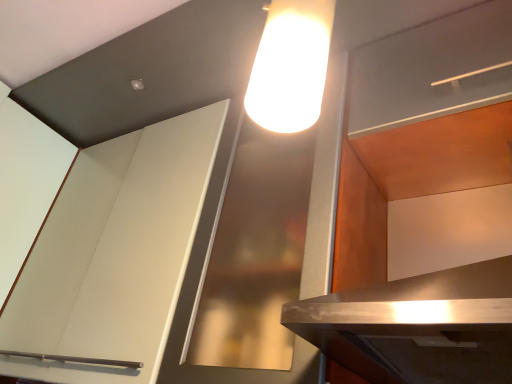
Identify the location of matte wood shelf at upper right. The image size is (512, 384). (433, 70).

I want to click on matte white cabinet at upper right, which ranks as the first cabinetry in right-to-left order, so click(421, 127).

Is white matte cabinet at upper left, marked as the 1th cabinetry in a left-to-right arrangement, facing towards matte white cabinet at upper right, which ranks as the first cabinetry in right-to-left order?

No, white matte cabinet at upper left, marked as the 1th cabinetry in a left-to-right arrangement, is not turned towards matte white cabinet at upper right, which ranks as the first cabinetry in right-to-left order.

Considering the relative sizes of white matte cabinet at upper left, arranged as the second cabinetry when viewed from the right, and matte white cabinet at upper right, which is counted as the second cabinetry, starting from the left, in the image provided, is white matte cabinet at upper left, arranged as the second cabinetry when viewed from the right, smaller than matte white cabinet at upper right, which is counted as the second cabinetry, starting from the left,?

No.

Is white matte cabinet at upper left, marked as the 1th cabinetry in a left-to-right arrangement, at the left side of matte white cabinet at upper right, which is counted as the second cabinetry, starting from the left?

Yes.

Is point (462, 50) positioned before point (154, 298)?

Yes, it is in front of point (154, 298).

Which of these two, matte white cabinet at upper right, which is counted as the second cabinetry, starting from the left, or white matte cabinet at upper left, marked as the 1th cabinetry in a left-to-right arrangement, is wider?

With larger width is matte white cabinet at upper right, which is counted as the second cabinetry, starting from the left.

Is matte white cabinet at upper right, which ranks as the first cabinetry in right-to-left order, inside the boundaries of white matte cabinet at upper left, marked as the 1th cabinetry in a left-to-right arrangement, or outside?

matte white cabinet at upper right, which ranks as the first cabinetry in right-to-left order, cannot be found inside white matte cabinet at upper left, marked as the 1th cabinetry in a left-to-right arrangement.

Relative to white matte cabinet at upper left, marked as the 1th cabinetry in a left-to-right arrangement, is matte white cabinet at upper right, which ranks as the first cabinetry in right-to-left order, in front or behind?

Visually, matte white cabinet at upper right, which ranks as the first cabinetry in right-to-left order, is located in front of white matte cabinet at upper left, marked as the 1th cabinetry in a left-to-right arrangement.

Can you confirm if matte wood shelf at upper right is bigger than matte white cabinet at upper right, which ranks as the first cabinetry in right-to-left order?

No.

From the image's perspective, is matte wood shelf at upper right positioned above or below matte white cabinet at upper right, which is counted as the second cabinetry, starting from the left?

matte wood shelf at upper right is situated higher than matte white cabinet at upper right, which is counted as the second cabinetry, starting from the left, in the image.

Between matte wood shelf at upper right and matte white cabinet at upper right, which is counted as the second cabinetry, starting from the left, which one appears on the right side from the viewer's perspective?

matte wood shelf at upper right is more to the right.

Can you tell me how much matte wood shelf at upper right and matte white cabinet at upper right, which is counted as the second cabinetry, starting from the left, differ in facing direction?

1.44 degrees.

Between matte white cabinet at upper right, which is counted as the second cabinetry, starting from the left, and matte wood shelf at upper right, which one has larger size?

matte white cabinet at upper right, which is counted as the second cabinetry, starting from the left.

Does matte white cabinet at upper right, which ranks as the first cabinetry in right-to-left order, come behind matte wood shelf at upper right?

That is False.

How different are the orientations of matte white cabinet at upper right, which is counted as the second cabinetry, starting from the left, and matte wood shelf at upper right in degrees?

matte white cabinet at upper right, which is counted as the second cabinetry, starting from the left, and matte wood shelf at upper right are facing 1.44 degrees away from each other.

From the image's perspective, does matte white cabinet at upper right, which ranks as the first cabinetry in right-to-left order, appear lower than matte wood shelf at upper right?

Indeed, from the image's perspective, matte white cabinet at upper right, which ranks as the first cabinetry in right-to-left order, is shown beneath matte wood shelf at upper right.

Is matte wood shelf at upper right positioned beyond the bounds of white matte cabinet at upper left, marked as the 1th cabinetry in a left-to-right arrangement?

matte wood shelf at upper right lies outside white matte cabinet at upper left, marked as the 1th cabinetry in a left-to-right arrangement,'s area.

Is matte wood shelf at upper right placed right next to white matte cabinet at upper left, arranged as the second cabinetry when viewed from the right?

No, matte wood shelf at upper right is not with white matte cabinet at upper left, arranged as the second cabinetry when viewed from the right.

What's the angular difference between matte wood shelf at upper right and white matte cabinet at upper left, marked as the 1th cabinetry in a left-to-right arrangement,'s facing directions?

They differ by 0.674 degrees in their facing directions.

From a real-world perspective, which object stands above the other?

matte wood shelf at upper right.

Which is closer, (183, 196) or (462, 66)?

Point (462, 66)

Considering the sizes of objects white matte cabinet at upper left, marked as the 1th cabinetry in a left-to-right arrangement, and matte wood shelf at upper right in the image provided, who is thinner, white matte cabinet at upper left, marked as the 1th cabinetry in a left-to-right arrangement, or matte wood shelf at upper right?

white matte cabinet at upper left, marked as the 1th cabinetry in a left-to-right arrangement, is thinner.

Choose the correct answer: Is white matte cabinet at upper left, marked as the 1th cabinetry in a left-to-right arrangement, inside matte wood shelf at upper right or outside it?

white matte cabinet at upper left, marked as the 1th cabinetry in a left-to-right arrangement, is located beyond the bounds of matte wood shelf at upper right.

Does white matte cabinet at upper left, marked as the 1th cabinetry in a left-to-right arrangement, touch matte wood shelf at upper right?

There is a gap between white matte cabinet at upper left, marked as the 1th cabinetry in a left-to-right arrangement, and matte wood shelf at upper right.

Image resolution: width=512 pixels, height=384 pixels. I want to click on cabinetry in front of the white matte cabinet at upper left, arranged as the second cabinetry when viewed from the right, so click(x=421, y=127).

In the image, there is a matte white cabinet at upper right, which is counted as the second cabinetry, starting from the left. At what (x,y) coordinates should I click in order to perform the action: click on cabinetry below it (from the image's perspective). Please return your answer as a coordinate pair (x, y). The image size is (512, 384). Looking at the image, I should click on (114, 254).

Based on their spatial positions, is matte white cabinet at upper right, which is counted as the second cabinetry, starting from the left, or white matte cabinet at upper left, marked as the 1th cabinetry in a left-to-right arrangement, closer to matte wood shelf at upper right?

matte white cabinet at upper right, which is counted as the second cabinetry, starting from the left, is positioned closer to the anchor matte wood shelf at upper right.

Which object lies nearer to the anchor point white matte cabinet at upper left, marked as the 1th cabinetry in a left-to-right arrangement, matte wood shelf at upper right or matte white cabinet at upper right, which is counted as the second cabinetry, starting from the left?

matte white cabinet at upper right, which is counted as the second cabinetry, starting from the left, is positioned closer to the anchor white matte cabinet at upper left, marked as the 1th cabinetry in a left-to-right arrangement.

Considering their positions, is matte wood shelf at upper right positioned further to matte white cabinet at upper right, which is counted as the second cabinetry, starting from the left, than white matte cabinet at upper left, arranged as the second cabinetry when viewed from the right?

white matte cabinet at upper left, arranged as the second cabinetry when viewed from the right.

Looking at the image, which one is located closer to matte white cabinet at upper right, which ranks as the first cabinetry in right-to-left order, white matte cabinet at upper left, arranged as the second cabinetry when viewed from the right, or matte wood shelf at upper right?

Based on the image, matte wood shelf at upper right appears to be nearer to matte white cabinet at upper right, which ranks as the first cabinetry in right-to-left order.

When comparing their distances from white matte cabinet at upper left, arranged as the second cabinetry when viewed from the right, does matte white cabinet at upper right, which is counted as the second cabinetry, starting from the left, or matte wood shelf at upper right seem closer?

The object closer to white matte cabinet at upper left, arranged as the second cabinetry when viewed from the right, is matte white cabinet at upper right, which is counted as the second cabinetry, starting from the left.

Considering their positions, is white matte cabinet at upper left, arranged as the second cabinetry when viewed from the right, positioned further to matte wood shelf at upper right than matte white cabinet at upper right, which ranks as the first cabinetry in right-to-left order?

white matte cabinet at upper left, arranged as the second cabinetry when viewed from the right, is further to matte wood shelf at upper right.

Locate an element on the screen. cabinetry between white matte cabinet at upper left, marked as the 1th cabinetry in a left-to-right arrangement, and matte wood shelf at upper right from left to right is located at coordinates (421, 127).